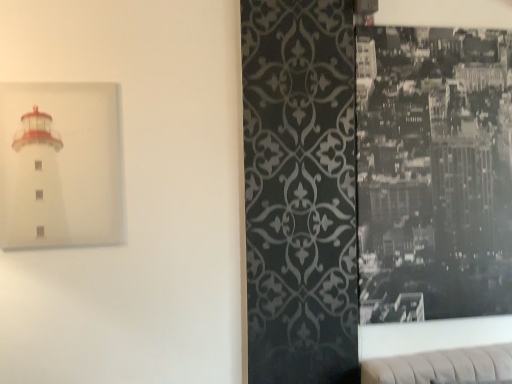
Question: Is white matte lighthouse at left, which ranks as the 1th picture frame in left-to-right order, positioned in front of black glossy photo at right, arranged as the first picture frame when viewed from the back?

Choices:
 (A) no
 (B) yes

Answer: (B)

Question: Considering the relative sizes of white matte lighthouse at left, the 1th picture frame from the front, and black glossy photo at right, the second picture frame viewed from the front, in the image provided, is white matte lighthouse at left, the 1th picture frame from the front, thinner than black glossy photo at right, the second picture frame viewed from the front,?

Choices:
 (A) yes
 (B) no

Answer: (A)

Question: From the image's perspective, is white matte lighthouse at left, the second picture frame in the right-to-left sequence, below black glossy photo at right, arranged as the first picture frame when viewed from the back?

Choices:
 (A) no
 (B) yes

Answer: (A)

Question: Is white matte lighthouse at left, placed as the second picture frame when sorted from back to front, turned away from black glossy photo at right, the second picture frame viewed from the front?

Choices:
 (A) no
 (B) yes

Answer: (A)

Question: Is white matte lighthouse at left, which ranks as the 1th picture frame in left-to-right order, not near black glossy photo at right, arranged as the first picture frame when viewed from the back?

Choices:
 (A) no
 (B) yes

Answer: (B)

Question: From a real-world perspective, is white matte lighthouse at left, the second picture frame in the right-to-left sequence, positioned under black glossy photo at right, which is counted as the 1th picture frame, starting from the right, based on gravity?

Choices:
 (A) yes
 (B) no

Answer: (B)

Question: Is black glossy photo at right, arranged as the first picture frame when viewed from the back, shorter than white matte lighthouse at left, the second picture frame in the right-to-left sequence?

Choices:
 (A) no
 (B) yes

Answer: (A)

Question: Is black glossy photo at right, arranged as the first picture frame when viewed from the back, thinner than white matte lighthouse at left, the second picture frame in the right-to-left sequence?

Choices:
 (A) yes
 (B) no

Answer: (B)

Question: Considering the relative positions of black glossy photo at right, the second picture frame viewed from the front, and white matte lighthouse at left, which ranks as the 1th picture frame in left-to-right order, in the image provided, is black glossy photo at right, the second picture frame viewed from the front, behind white matte lighthouse at left, which ranks as the 1th picture frame in left-to-right order,?

Choices:
 (A) yes
 (B) no

Answer: (A)

Question: From the image's perspective, is black glossy photo at right, arranged as the first picture frame when viewed from the back, beneath white matte lighthouse at left, which ranks as the 1th picture frame in left-to-right order?

Choices:
 (A) no
 (B) yes

Answer: (B)

Question: Is black glossy photo at right, acting as the second picture frame starting from the left, positioned before white matte lighthouse at left, the second picture frame in the right-to-left sequence?

Choices:
 (A) yes
 (B) no

Answer: (B)

Question: Is black glossy photo at right, acting as the second picture frame starting from the left, at the right side of white matte lighthouse at left, the second picture frame in the right-to-left sequence?

Choices:
 (A) no
 (B) yes

Answer: (B)

Question: Based on their positions, is white matte lighthouse at left, the 1th picture frame from the front, located to the left or right of black glossy photo at right, acting as the second picture frame starting from the left?

Choices:
 (A) left
 (B) right

Answer: (A)